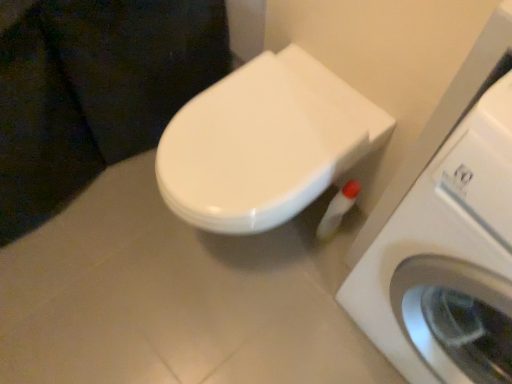
Question: Is white glossy toilet at center placed right next to white plastic washing machine at right?

Choices:
 (A) no
 (B) yes

Answer: (A)

Question: Can you confirm if white glossy toilet at center is shorter than white plastic washing machine at right?

Choices:
 (A) no
 (B) yes

Answer: (B)

Question: From a real-world perspective, is white glossy toilet at center positioned over white plastic washing machine at right based on gravity?

Choices:
 (A) yes
 (B) no

Answer: (B)

Question: Is white glossy toilet at center looking in the opposite direction of white plastic washing machine at right?

Choices:
 (A) yes
 (B) no

Answer: (B)

Question: From the image's perspective, is white glossy toilet at center above white plastic washing machine at right?

Choices:
 (A) yes
 (B) no

Answer: (A)

Question: In terms of height, does white glossy toilet paper at lower right look taller or shorter compared to white plastic washing machine at right?

Choices:
 (A) short
 (B) tall

Answer: (A)

Question: In the image, is white glossy toilet paper at lower right on the left side or the right side of white plastic washing machine at right?

Choices:
 (A) left
 (B) right

Answer: (A)

Question: In the image, is white glossy toilet paper at lower right positioned in front of or behind white plastic washing machine at right?

Choices:
 (A) behind
 (B) front

Answer: (A)

Question: Is white glossy toilet paper at lower right spatially inside white plastic washing machine at right, or outside of it?

Choices:
 (A) outside
 (B) inside

Answer: (A)

Question: From a real-world perspective, is white plastic washing machine at right physically located above or below white glossy toilet at center?

Choices:
 (A) above
 (B) below

Answer: (A)

Question: From the image's perspective, relative to white glossy toilet at center, is white plastic washing machine at right above or below?

Choices:
 (A) above
 (B) below

Answer: (B)

Question: Is point (371, 278) closer or farther from the camera than point (297, 195)?

Choices:
 (A) closer
 (B) farther

Answer: (B)

Question: Is white plastic washing machine at right in front of or behind white glossy toilet at center in the image?

Choices:
 (A) behind
 (B) front

Answer: (B)

Question: From a real-world perspective, is white glossy toilet at center physically located above or below white glossy toilet paper at lower right?

Choices:
 (A) below
 (B) above

Answer: (B)

Question: Choose the correct answer: Is white glossy toilet at center inside white glossy toilet paper at lower right or outside it?

Choices:
 (A) inside
 (B) outside

Answer: (B)